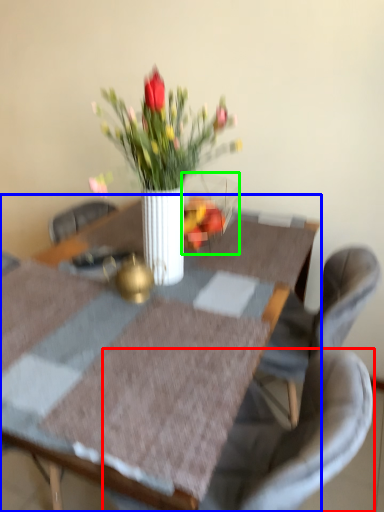
Question: Estimate the real-world distances between objects in this image. Which object is farther from chair (highlighted by a red box), table (highlighted by a blue box) or glass vase (highlighted by a green box)?

Choices:
 (A) table
 (B) glass vase

Answer: (B)